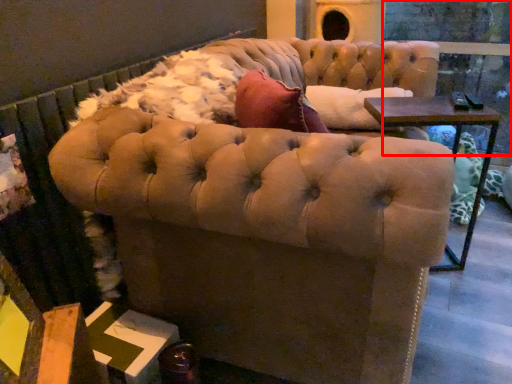
Question: Observing the image, what is the correct spatial positioning of glass door (annotated by the red box) in reference to chair?

Choices:
 (A) right
 (B) left

Answer: (A)